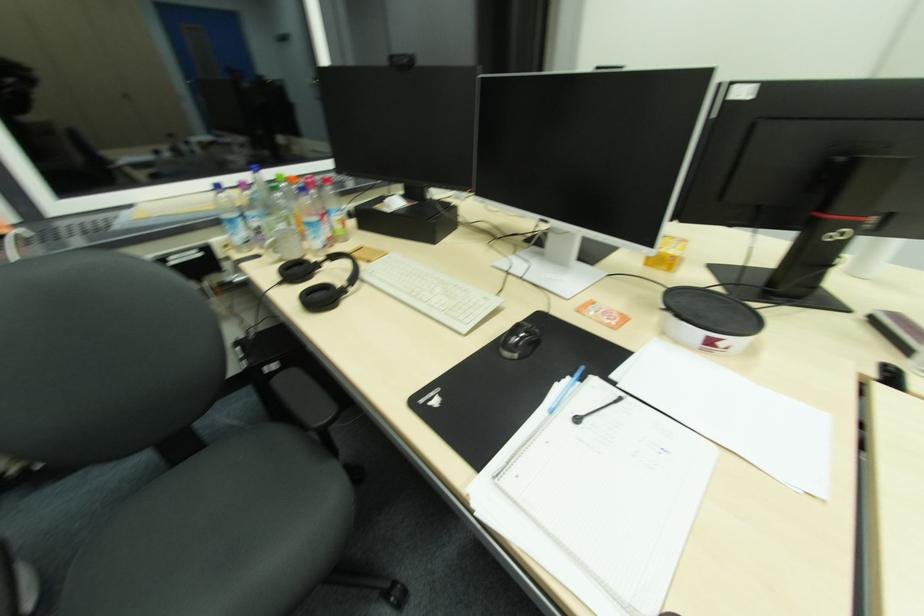
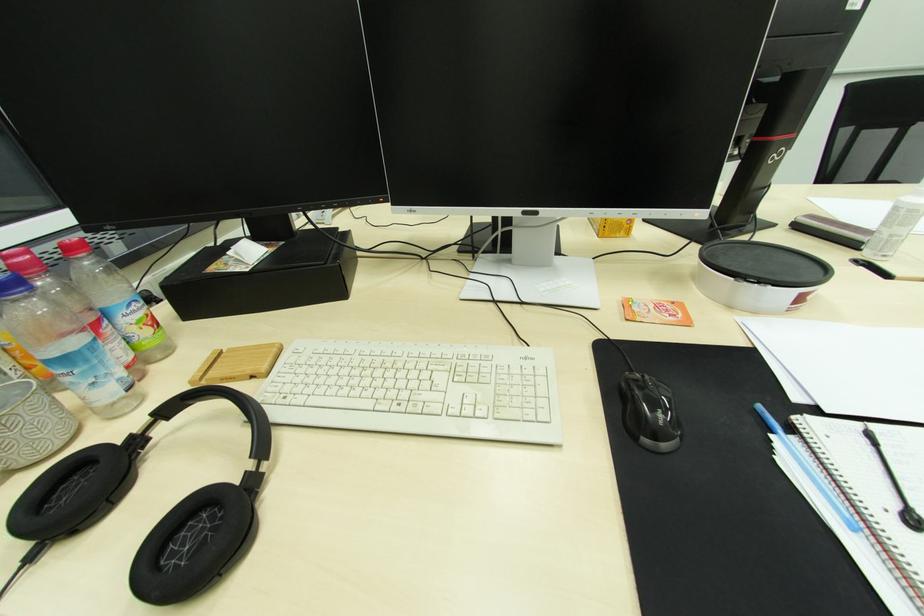
Question: The camera is either moving clockwise (left) or counter-clockwise (right) around the object. The first image is from the beginning of the video and the second image is from the end. Is the camera moving left or right when shooting the video?

Choices:
 (A) Left
 (B) Right

Answer: (A)